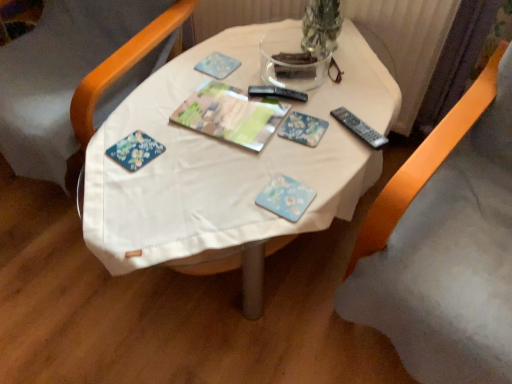
Image resolution: width=512 pixels, height=384 pixels. I want to click on vacant space behind black plastic remote at right, so click(351, 93).